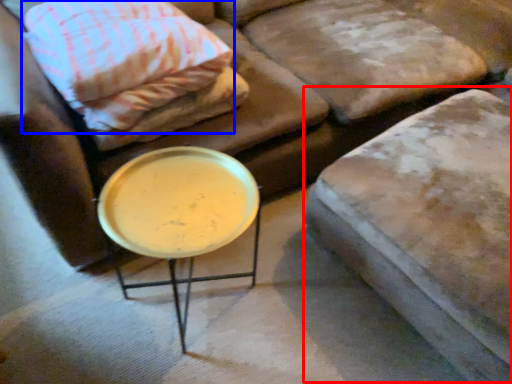
Question: Among these objects, which one is nearest to the camera, swivel chair (highlighted by a red box) or pillow (highlighted by a blue box)?

Choices:
 (A) swivel chair
 (B) pillow

Answer: (A)